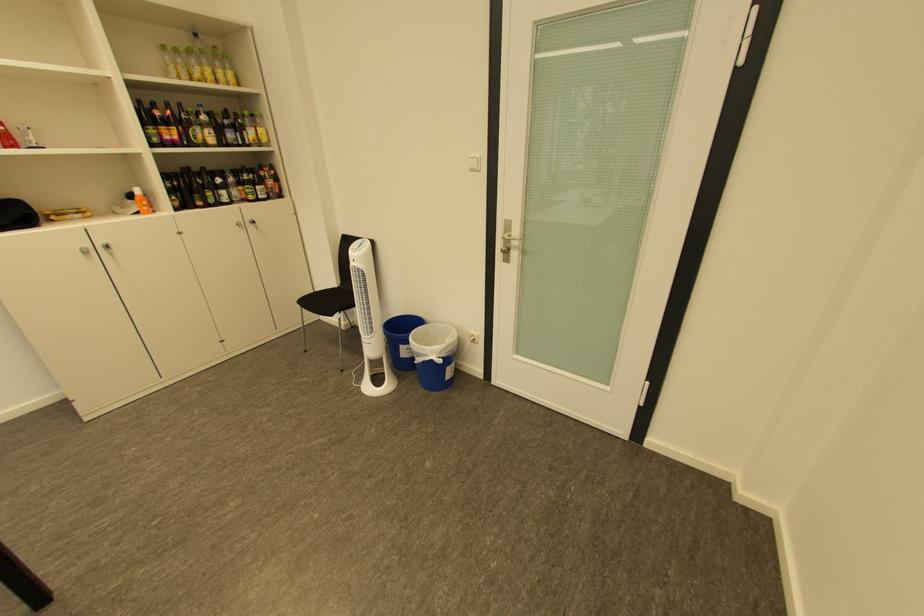
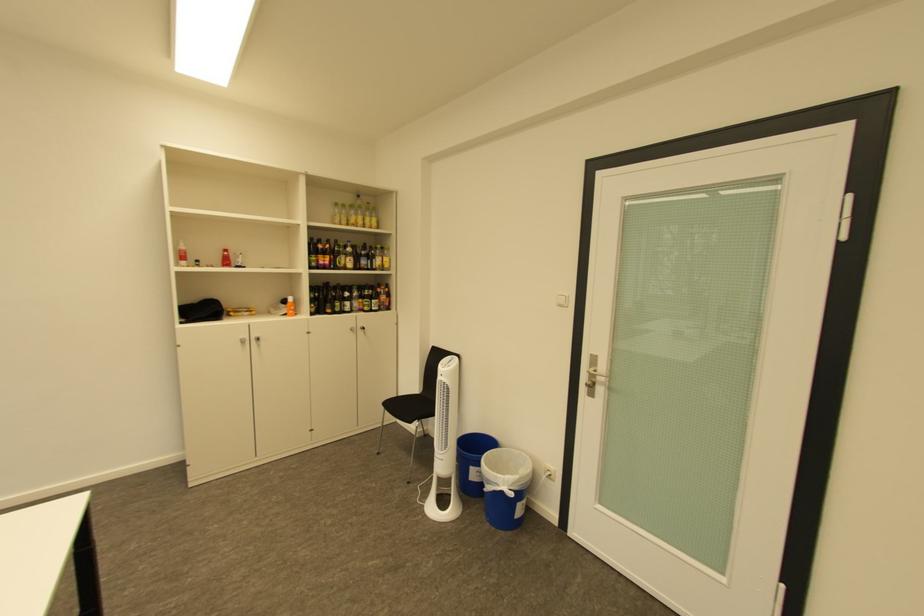
Which direction would the cameraman need to move to produce the second image?

The movement direction of the cameraman is left, backward.